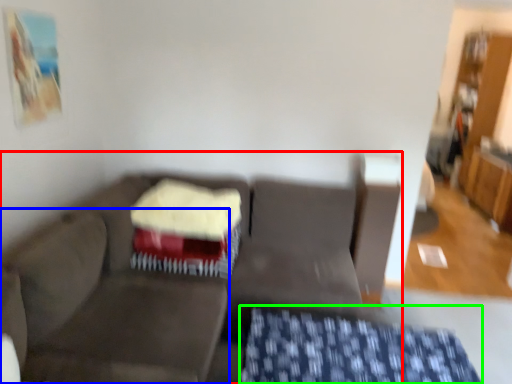
Question: Considering the real-world distances, which object is farthest from studio couch (highlighted by a red box)? swivel chair (highlighted by a blue box) or tablecloth (highlighted by a green box)?

Choices:
 (A) swivel chair
 (B) tablecloth

Answer: (B)